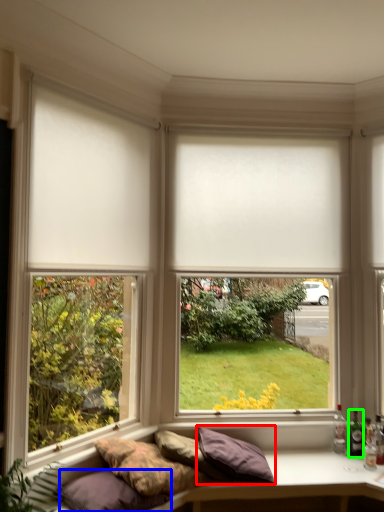
Question: Estimate the real-world distances between objects in this image. Which object is farther from pillow (highlighted by a red box), pillow (highlighted by a blue box) or bottle (highlighted by a green box)?

Choices:
 (A) pillow
 (B) bottle

Answer: (B)